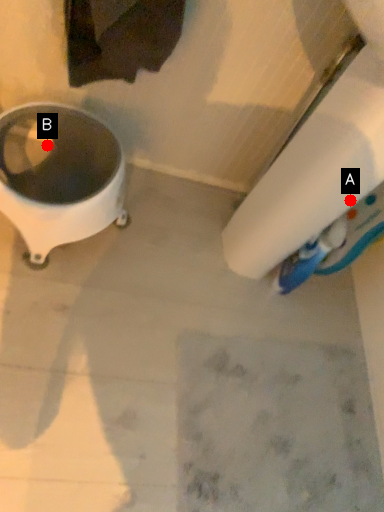
Question: Two points are circled on the image, labeled by A and B beside each circle. Which of the following is the farthest from the observer?

Choices:
 (A) A is further
 (B) B is further

Answer: (B)